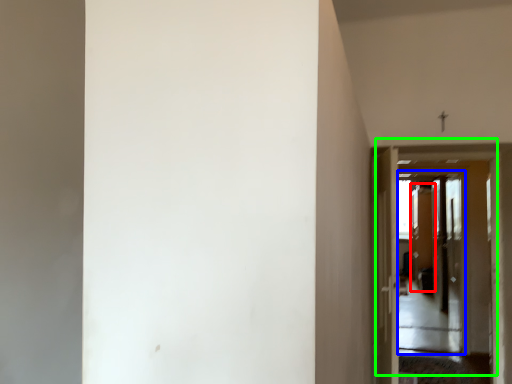
Question: Based on their relative distances, which object is nearer to screen door (highlighted by a red box)? Choose from screen door (highlighted by a blue box) and door (highlighted by a green box).

Choices:
 (A) screen door
 (B) door

Answer: (A)